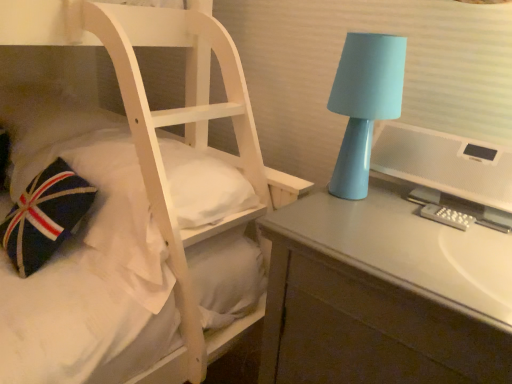
This screenshot has height=384, width=512. In order to click on vacant area that is in front of white textured computer monitor at right in this screenshot , I will do `click(438, 251)`.